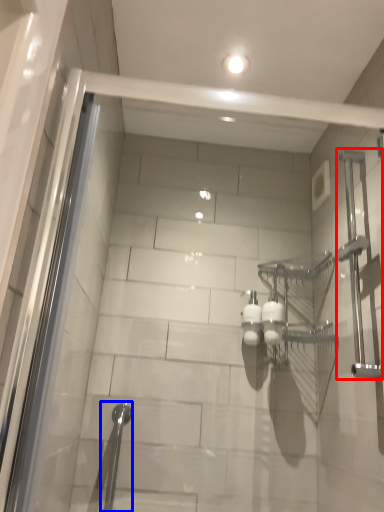
Question: Which object is further to the camera taking this photo, shower (highlighted by a red box) or shower (highlighted by a blue box)?

Choices:
 (A) shower
 (B) shower

Answer: (B)